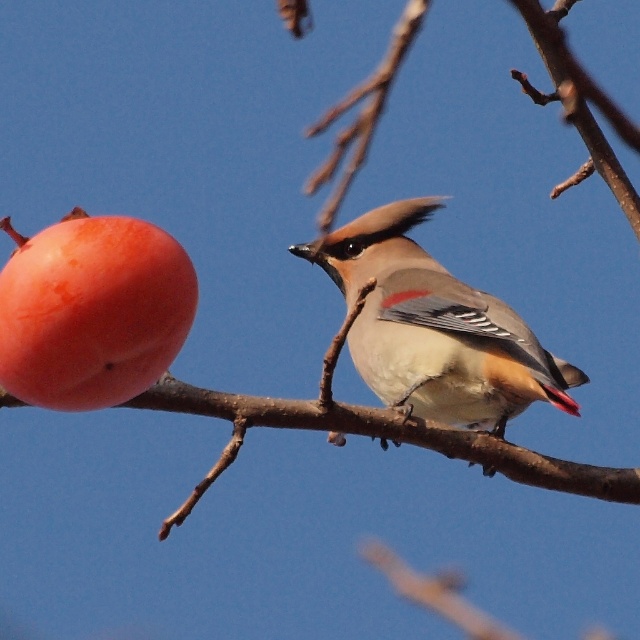
Question: Can you confirm if matte gray bird at center is bigger than smooth orange persimmon at left?

Choices:
 (A) no
 (B) yes

Answer: (B)

Question: Which of the following is the closest to the observer?

Choices:
 (A) (490, 358)
 (B) (116, 236)

Answer: (B)

Question: Can you confirm if matte gray bird at center is bigger than smooth orange persimmon at left?

Choices:
 (A) yes
 (B) no

Answer: (A)

Question: Which object is closer to the camera taking this photo?

Choices:
 (A) matte gray bird at center
 (B) smooth orange persimmon at left

Answer: (B)

Question: Is the position of matte gray bird at center more distant than that of smooth orange persimmon at left?

Choices:
 (A) no
 (B) yes

Answer: (B)